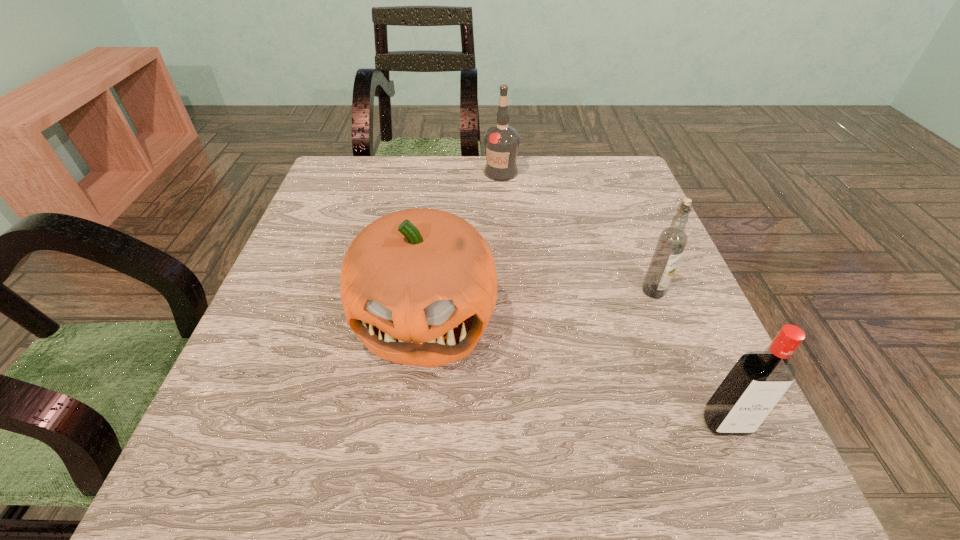
The width and height of the screenshot is (960, 540). In the image, there is a desktop. Identify the location of vacant space at the far edge. (549, 183).

Find the location of `free space at the left edge of the desktop`. free space at the left edge of the desktop is located at coordinates (271, 439).

Locate an element on the screen. Image resolution: width=960 pixels, height=540 pixels. vacant space at the right edge of the desktop is located at coordinates (644, 357).

The width and height of the screenshot is (960, 540). Identify the location of vacant space at the far left corner of the desktop. (386, 170).

This screenshot has height=540, width=960. In order to click on vacant space at the far right corner in this screenshot , I will do `click(599, 195)`.

Identify the location of free space between the pumpkin and the second nearest vodka. The image size is (960, 540). pyautogui.click(x=540, y=305).

Locate an element on the screen. free space that is in between the nearest object and the second farthest vodka is located at coordinates (689, 357).

At what (x,y) coordinates should I click in order to perform the action: click on vacant area that lies between the second nearest vodka and the nearest object. Please return your answer as a coordinate pair (x, y). This screenshot has height=540, width=960. Looking at the image, I should click on (689, 357).

The height and width of the screenshot is (540, 960). Find the location of `free spot between the leftmost vodka and the nearest vodka`. free spot between the leftmost vodka and the nearest vodka is located at coordinates (613, 298).

The width and height of the screenshot is (960, 540). Find the location of `free space between the second farthest vodka and the nearest vodka`. free space between the second farthest vodka and the nearest vodka is located at coordinates (689, 357).